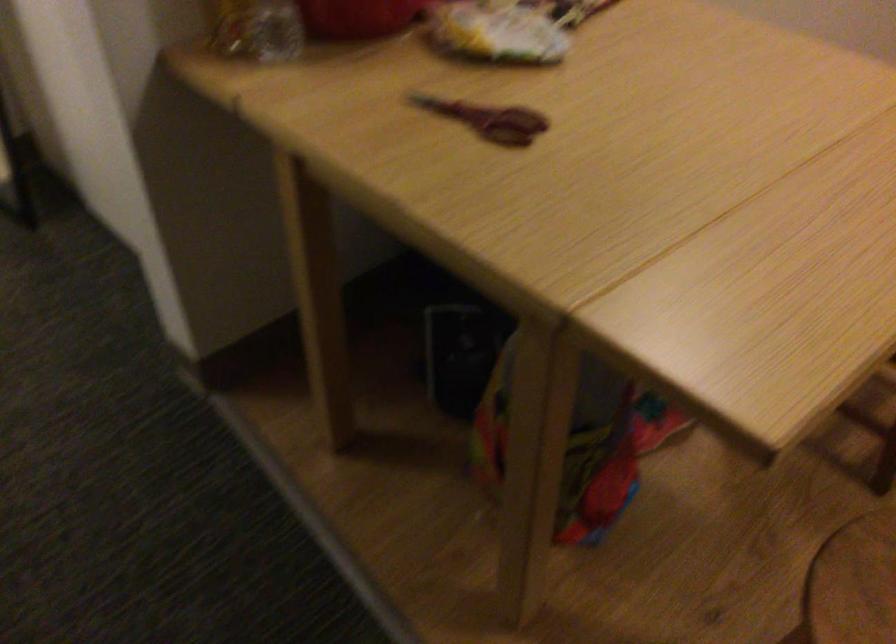
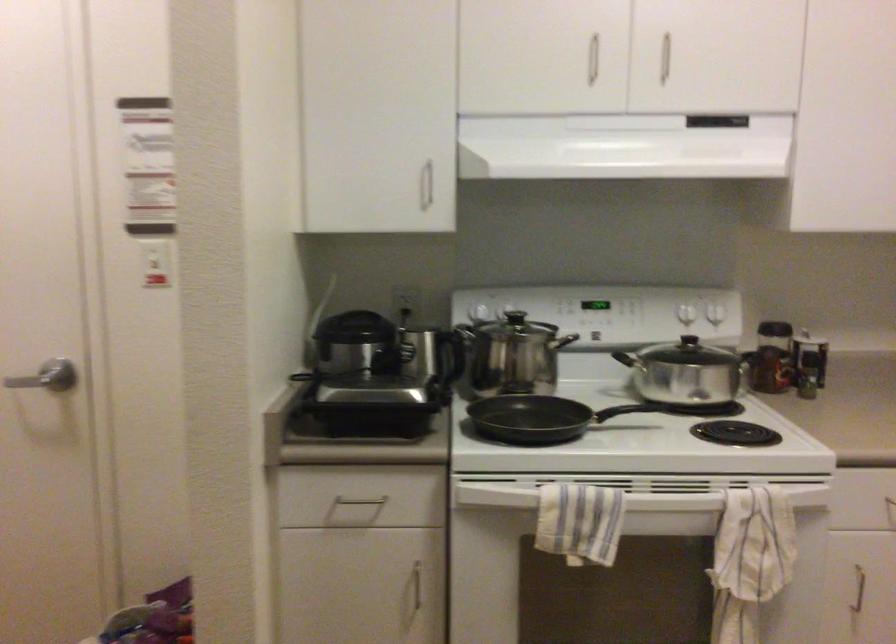
First-person continuous shooting, in which direction is the camera rotating?

The rotation direction of the camera is right-up.